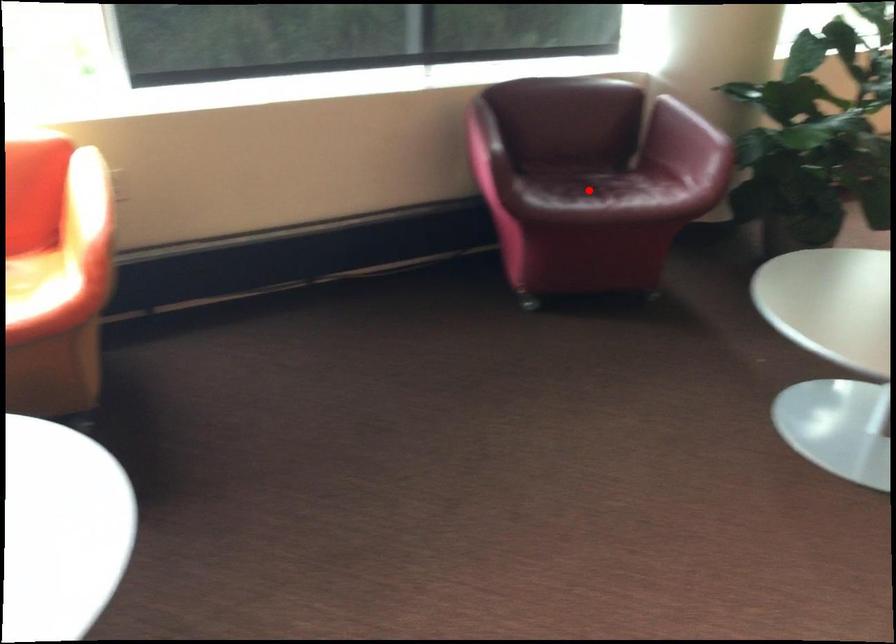
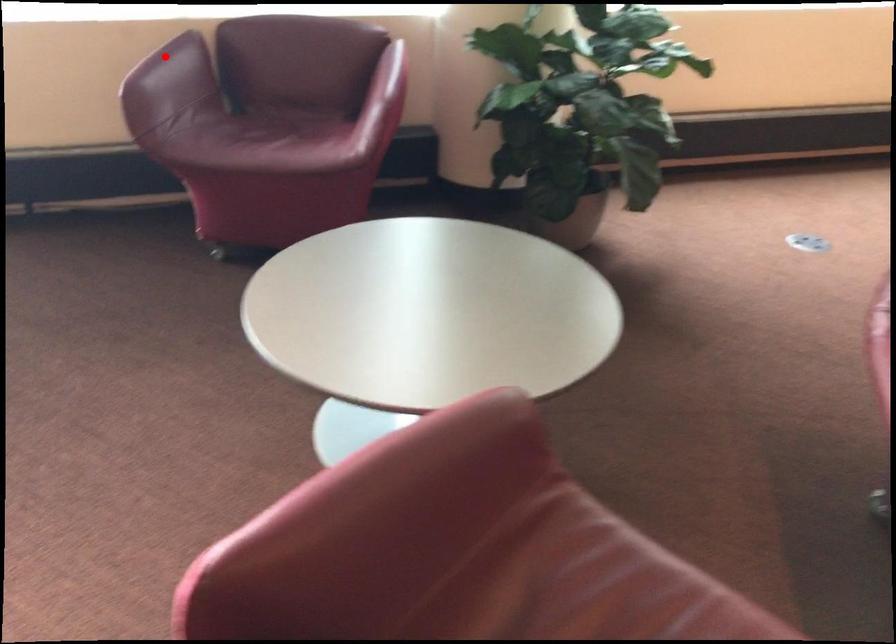
I am providing you with two images of the same scene from different viewpoints. A red point is marked on the first image and another point is marked on the second image. Are the points marked in image1 and image2 representing the same 3D position?

No